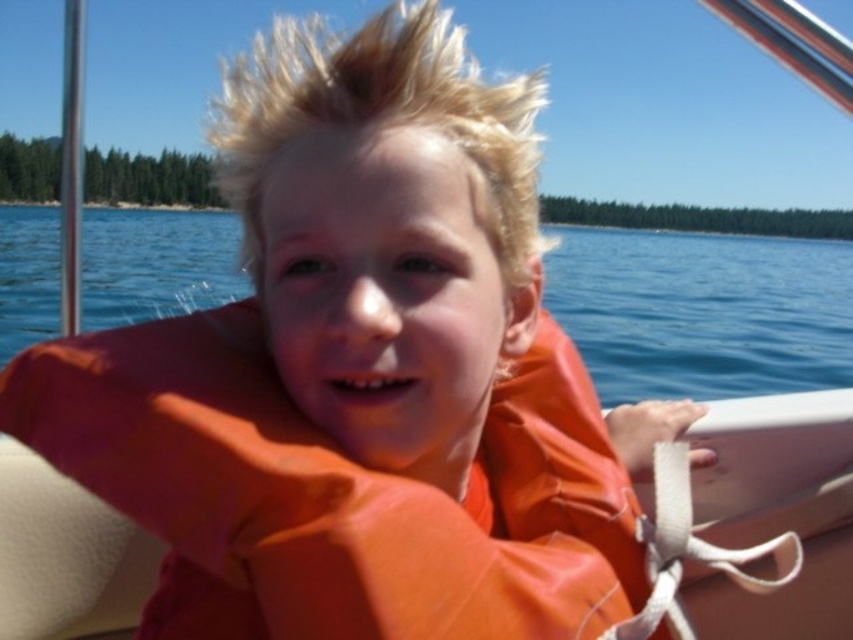
You are a safety inspector checking the distance between the orange matte life jacket at center and the child wearing it. According to safety regulations, the maximum allowed distance between a life jacket and the wearer should not exceed 18 inches. Is this setup compliant with safety standards?

The orange matte life jacket at center and viewer are 20.73 inches apart from each other, which exceeds the maximum allowed distance of 18 inches. Therefore, this setup does not comply with safety standards.

You are a photographer trying to capture the orange matte life jacket at center and the blue water at center in a single shot. Based on their positions, which object is closer to the right edge of the photo?

The orange matte life jacket at center is positioned on the right side of blue water at center, so it is closer to the right edge of the photo.

You are a safety inspector checking the boat. The orange matte life jacket at center must be placed in a specific location relative to the blue water at center. According to safety regulations, the life jacket must be thicker than the water in that area. Is the current placement compliant?

The orange matte life jacket at center is thinner than blue water at center, so the current placement is not compliant with safety regulations since the life jacket must be thicker than the water in that area.